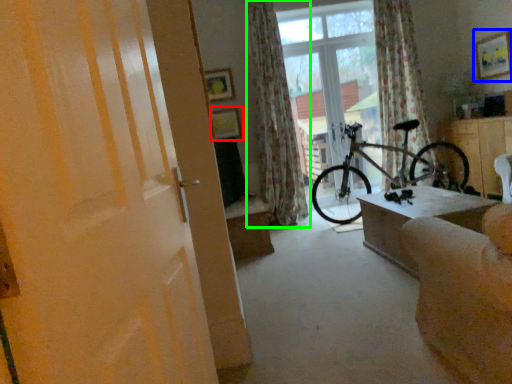
Question: Which is nearer to the picture frame (highlighted by a red box)? picture frame (highlighted by a blue box) or curtain (highlighted by a green box).

Choices:
 (A) picture frame
 (B) curtain

Answer: (B)